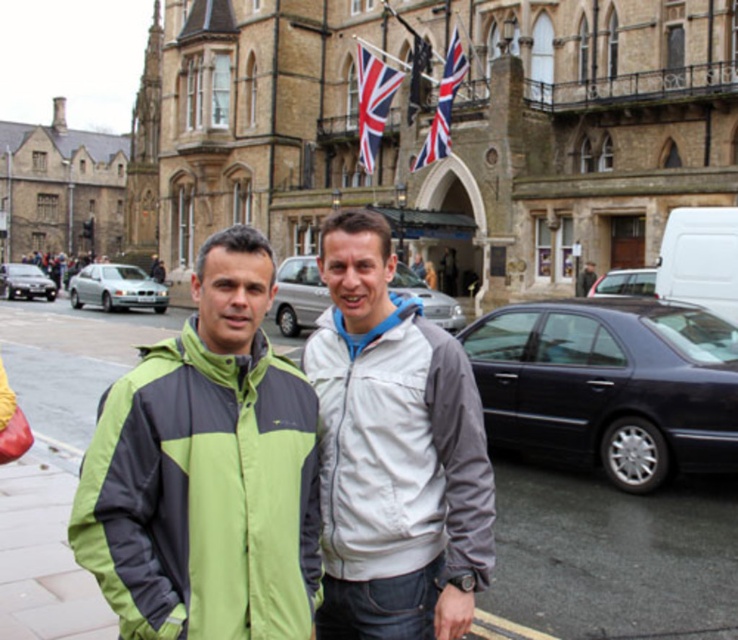
Does shiny silver sedan at center appear under dark gray jacket at center?

Correct, shiny silver sedan at center is located below dark gray jacket at center.

In the scene shown: Does shiny silver sedan at center appear over dark gray jacket at center?

No, shiny silver sedan at center is not above dark gray jacket at center.

Who is more forward, (655, 268) or (593, 278)?

Point (655, 268) is more forward.

At what (x,y) coordinates should I click in order to perform the action: click on shiny silver sedan at center. Please return your answer as a coordinate pair (x, y). The height and width of the screenshot is (640, 738). Looking at the image, I should click on click(x=624, y=282).

Does light gray fabric jacket at center appear on the left side of silver metallic sedan at center?

In fact, light gray fabric jacket at center is to the right of silver metallic sedan at center.

Between point (446, 470) and point (283, 332), which one is positioned in front?

Point (446, 470)

What are the coordinates of `light gray fabric jacket at center` in the screenshot? It's located at (400, 451).

Which is below, satin silver metallic sedan at left or union jack fabric flag at upper center?

satin silver metallic sedan at left is lower down.

Between point (97, 298) and point (362, 152), which one is positioned in front?

Point (97, 298) is more forward.

This screenshot has height=640, width=738. What do you see at coordinates (117, 288) in the screenshot? I see `satin silver metallic sedan at left` at bounding box center [117, 288].

Find the location of a particular element. The height and width of the screenshot is (640, 738). satin silver metallic sedan at left is located at coordinates (117, 288).